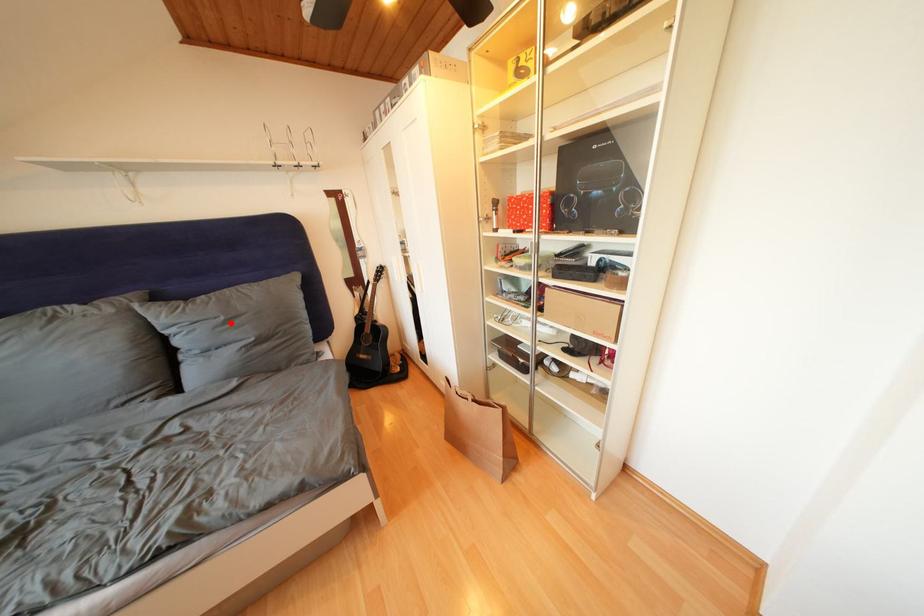
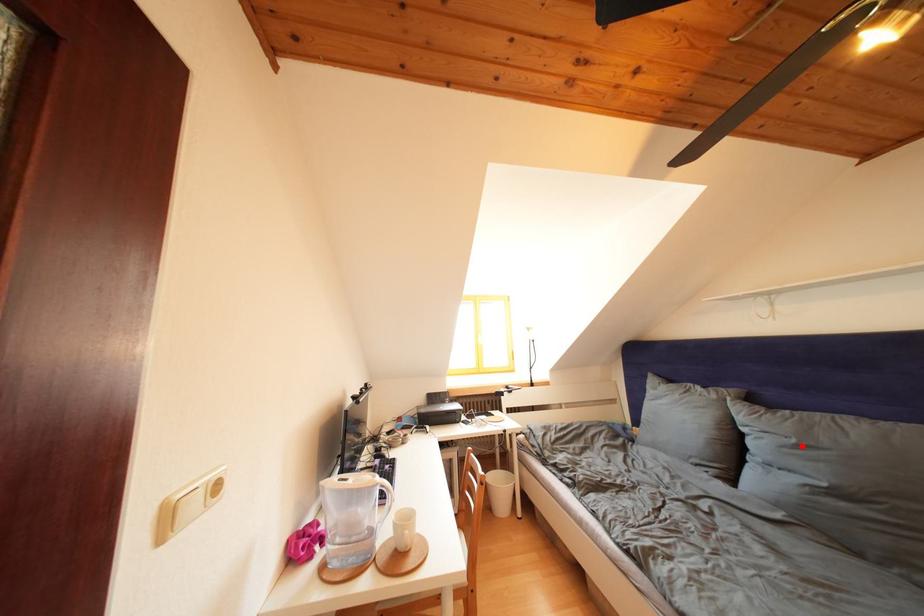
I am providing you with two images of the same scene from different viewpoints. A red point is marked on the first image and another point is marked on the second image. Are the points marked in image1 and image2 representing the same 3D position?

Yes